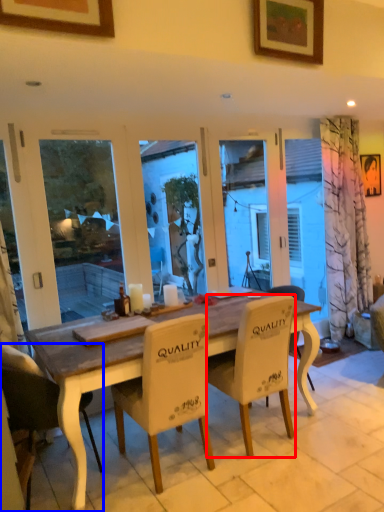
Question: Which point is closer to the camera, chair (highlighted by a red box) or chair (highlighted by a blue box)?

Choices:
 (A) chair
 (B) chair

Answer: (B)